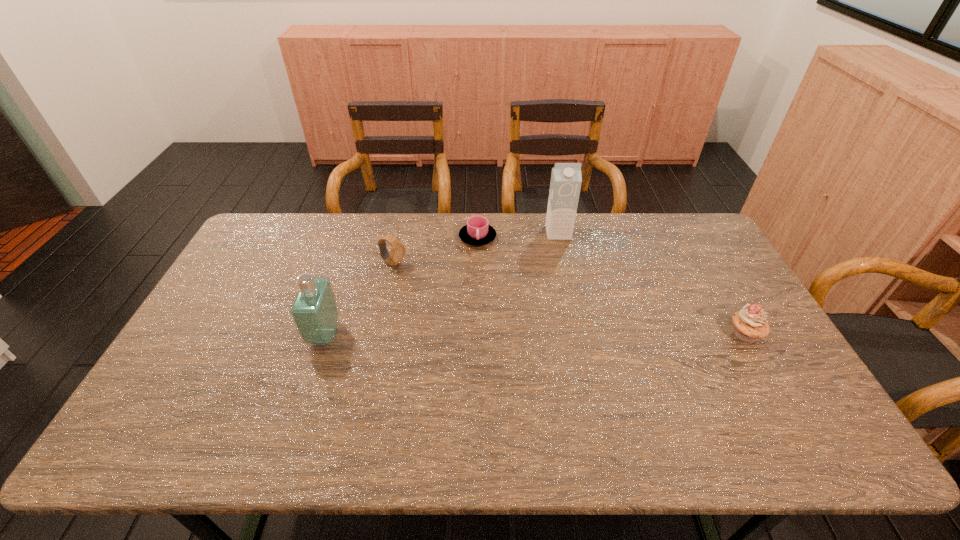
The height and width of the screenshot is (540, 960). I want to click on empty location between the perfume and the shortest object, so click(401, 286).

The width and height of the screenshot is (960, 540). I want to click on vacant area that lies between the tallest object and the leftmost object, so click(x=442, y=284).

At what (x,y) coordinates should I click in order to perform the action: click on vacant region between the third nearest object and the leftmost object. Please return your answer as a coordinate pair (x, y). Looking at the image, I should click on (359, 300).

Locate an element on the screen. The height and width of the screenshot is (540, 960). vacant space that's between the perfume and the fourth object from left to right is located at coordinates (442, 284).

Locate an element on the screen. This screenshot has width=960, height=540. free area in between the third nearest object and the carton is located at coordinates (476, 248).

Image resolution: width=960 pixels, height=540 pixels. In order to click on free area in between the carton and the cup in this screenshot , I will do `click(517, 235)`.

Where is `free point between the fourth object from left to right and the shortest object`? free point between the fourth object from left to right and the shortest object is located at coordinates (517, 235).

The height and width of the screenshot is (540, 960). In order to click on vacant point located between the cup and the fourth object from left to right in this screenshot , I will do (x=517, y=235).

Where is `blank region between the cup and the second object from right to left`? Image resolution: width=960 pixels, height=540 pixels. blank region between the cup and the second object from right to left is located at coordinates (517, 235).

Where is `vacant area between the cupcake and the fourth shortest object`? The image size is (960, 540). vacant area between the cupcake and the fourth shortest object is located at coordinates (535, 334).